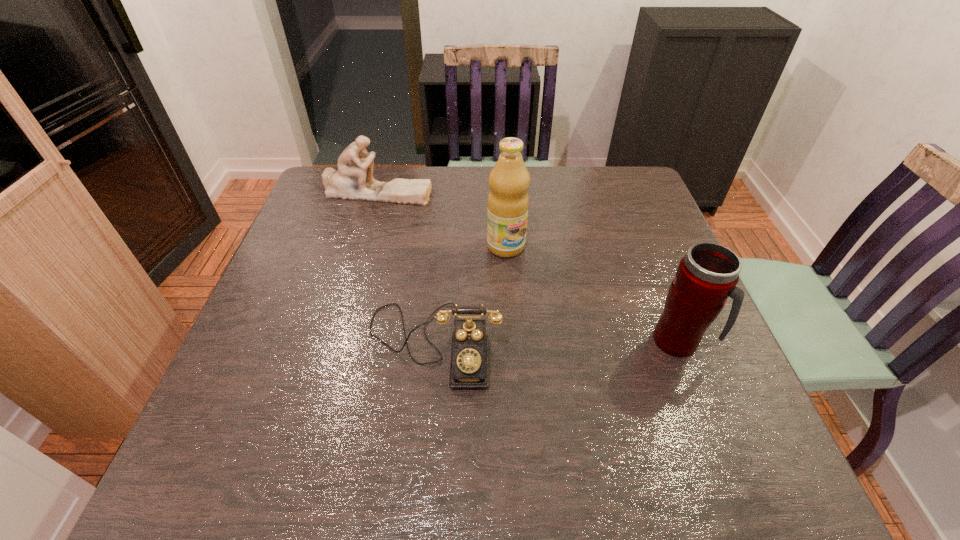
Image resolution: width=960 pixels, height=540 pixels. In order to click on vacant space at the left edge of the desktop in this screenshot , I will do `click(300, 294)`.

In the image, there is a desktop. Where is `vacant space at the right edge`? The image size is (960, 540). vacant space at the right edge is located at coordinates (678, 364).

At what (x,y) coordinates should I click in order to perform the action: click on vacant space at the far right corner of the desktop. Please return your answer as a coordinate pair (x, y). The height and width of the screenshot is (540, 960). Looking at the image, I should click on (627, 198).

In the image, there is a desktop. Where is `vacant space at the near right corner`? The image size is (960, 540). vacant space at the near right corner is located at coordinates (675, 398).

This screenshot has width=960, height=540. Find the location of `free space between the figurine and the thermos bottle`. free space between the figurine and the thermos bottle is located at coordinates (527, 267).

Find the location of a particular element. empty location between the figurine and the third nearest object is located at coordinates point(441,219).

Image resolution: width=960 pixels, height=540 pixels. I want to click on free space between the second shortest object and the olive oil, so [441, 219].

You are a GUI agent. You are given a task and a screenshot of the screen. Output one action in this format:
    pyautogui.click(x=<x>, y=<y>)
    Task: Click on the empty location between the shortest object and the third shortest object
    This screenshot has height=540, width=960.
    Given the screenshot: What is the action you would take?
    pyautogui.click(x=556, y=343)

Where is `unoccupied position between the figurine and the shortest object`? unoccupied position between the figurine and the shortest object is located at coordinates (405, 268).

At what (x,y) coordinates should I click in order to perform the action: click on vacant region between the shortest object and the second tallest object. Please return your answer as a coordinate pair (x, y). Looking at the image, I should click on (556, 343).